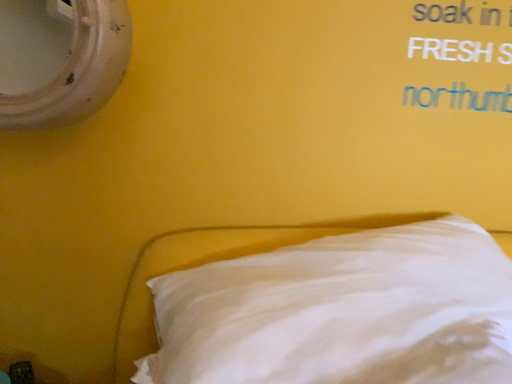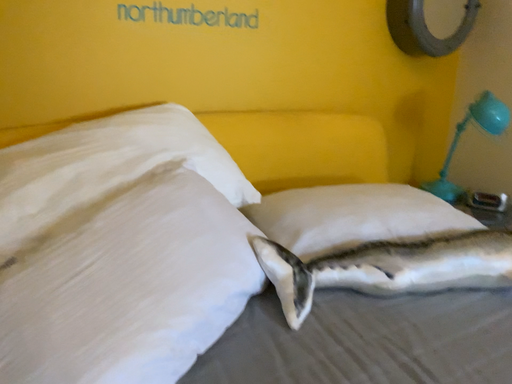
Question: How did the camera likely rotate when shooting the video?

Choices:
 (A) rotated upward
 (B) rotated downward

Answer: (B)